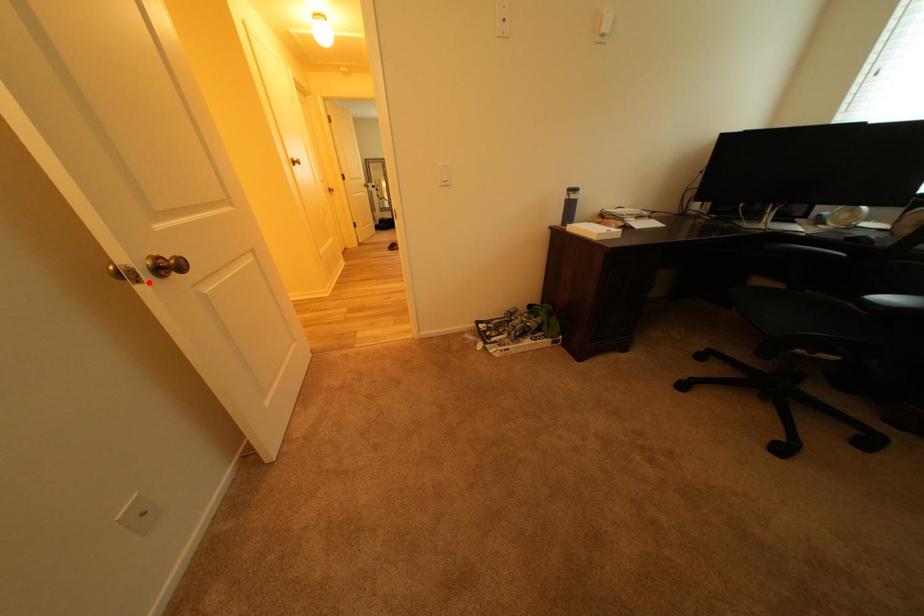
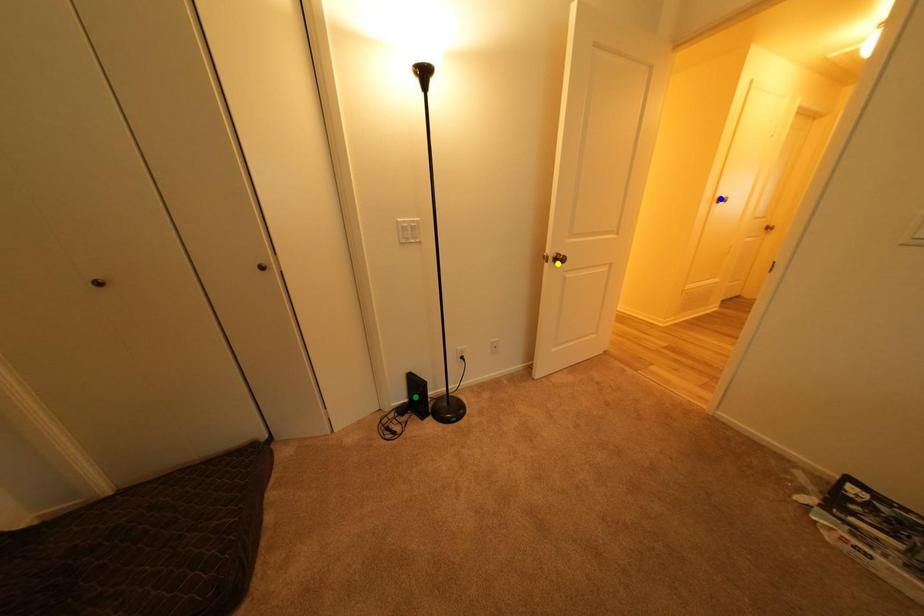
Question: I am providing you with two images of the same scene from different viewpoints. A red point is marked on the first image. You are given multiple points on the second image. Can you choose the point in image 2 that corresponds to the point in image 1?

Choices:
 (A) green point
 (B) blue point
 (C) yellow point

Answer: (C)